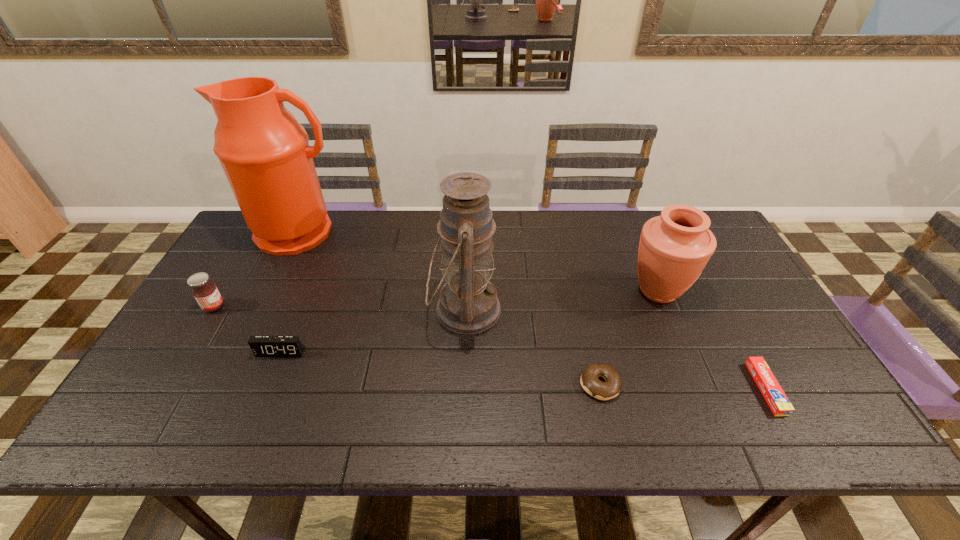
Locate an element on the screen. This screenshot has height=540, width=960. toothpaste is located at coordinates (774, 395).

Find the location of a particular element. vacant area located 0.240m from the spout of the farthest object is located at coordinates (261, 313).

Find the location of a particular element. Image resolution: width=960 pixels, height=540 pixels. free location located on the back of the second tallest object is located at coordinates (467, 264).

The image size is (960, 540). Find the location of `vacant space located 0.290m on the back of the fifth shortest object`. vacant space located 0.290m on the back of the fifth shortest object is located at coordinates (627, 215).

Find the location of a particular element. The width and height of the screenshot is (960, 540). vacant space located on the label side of the jam is located at coordinates (352, 307).

Find the location of a particular element. Image resolution: width=960 pixels, height=540 pixels. vacant area situated on the front-facing side of the alarm clock is located at coordinates (264, 392).

The image size is (960, 540). I want to click on vacant region located on the back of the second shortest object, so click(x=582, y=306).

Where is `vacant space located on the back of the shortest object`? vacant space located on the back of the shortest object is located at coordinates (696, 260).

Image resolution: width=960 pixels, height=540 pixels. Find the location of `object that is at the far edge`. object that is at the far edge is located at coordinates (264, 152).

Find the location of a particular element. object that is at the near edge is located at coordinates tap(774, 395).